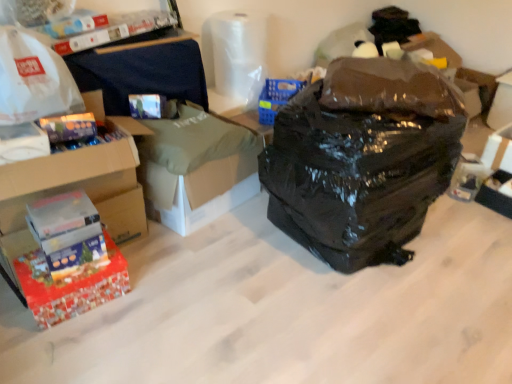
This screenshot has width=512, height=384. I want to click on vacant space positioned to the left of black plastic bag at center, so click(x=224, y=260).